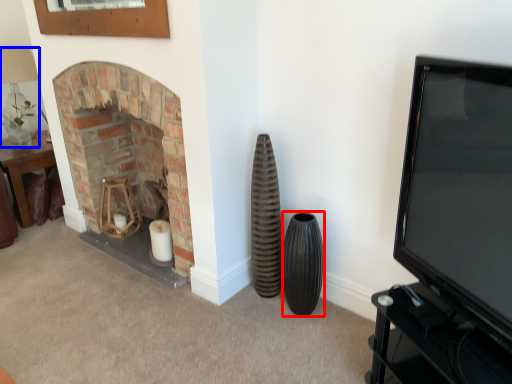
Question: Among these objects, which one is nearest to the camera, vase (highlighted by a red box) or lamp (highlighted by a blue box)?

Choices:
 (A) vase
 (B) lamp

Answer: (A)